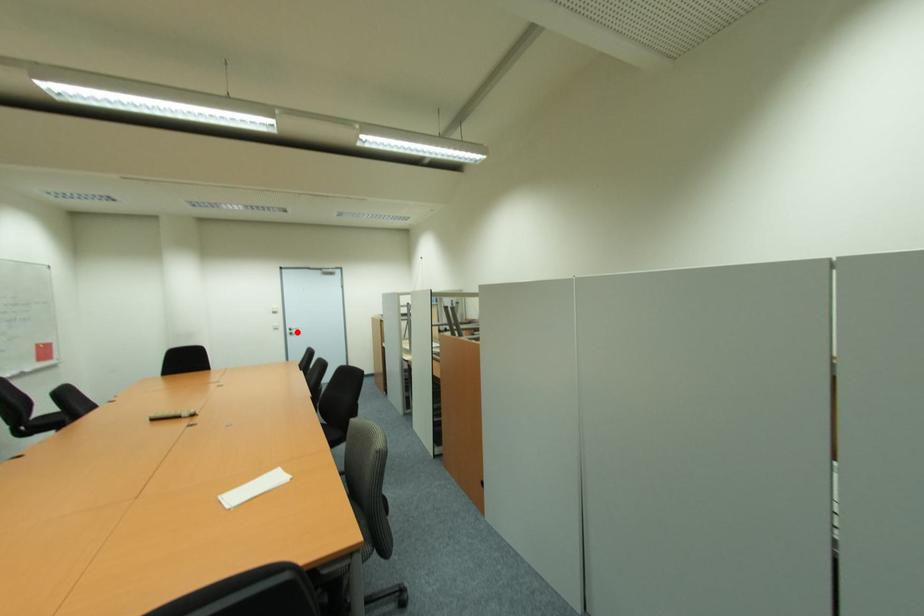
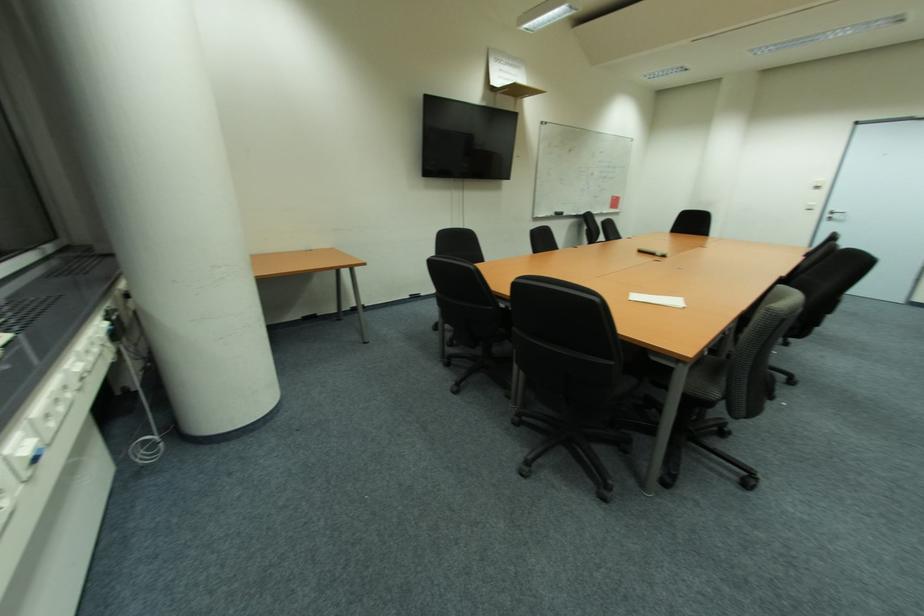
The point at the highlighted location is marked in the first image. Where is the corresponding point in the second image?

(842, 217)